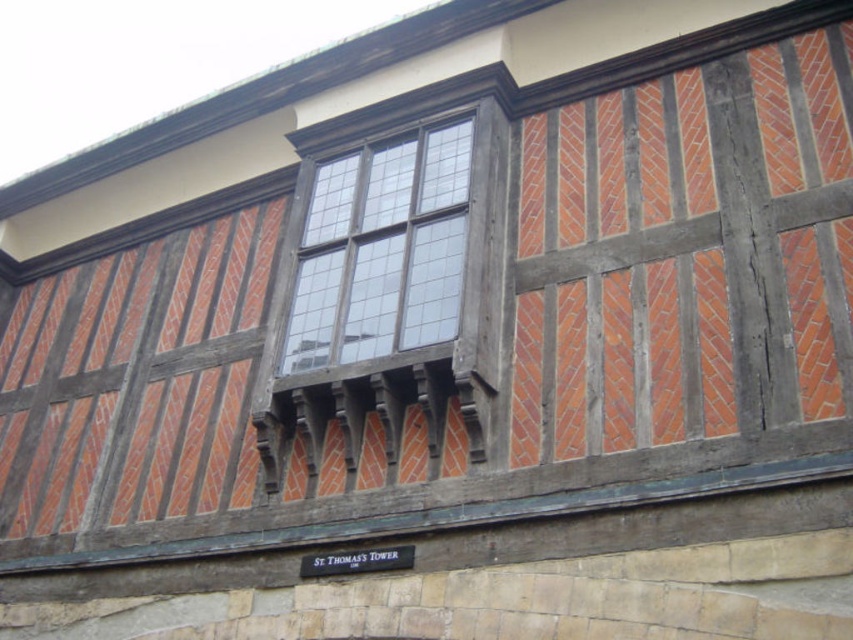
Question: Which point appears closest to the camera in this image?

Choices:
 (A) (503, 256)
 (B) (383, 170)

Answer: (A)

Question: Can you confirm if dark brown wood at center is wider than clear glass window at center?

Choices:
 (A) yes
 (B) no

Answer: (A)

Question: Is dark brown wood at center smaller than clear glass window at center?

Choices:
 (A) no
 (B) yes

Answer: (A)

Question: Does dark brown wood at center have a lesser width compared to clear glass window at center?

Choices:
 (A) no
 (B) yes

Answer: (A)

Question: Which of the following is the closest to the observer?

Choices:
 (A) clear glass window at center
 (B) dark brown wood at center

Answer: (B)

Question: Which point appears closest to the camera in this image?

Choices:
 (A) 367,273
 (B) 410,209

Answer: (A)